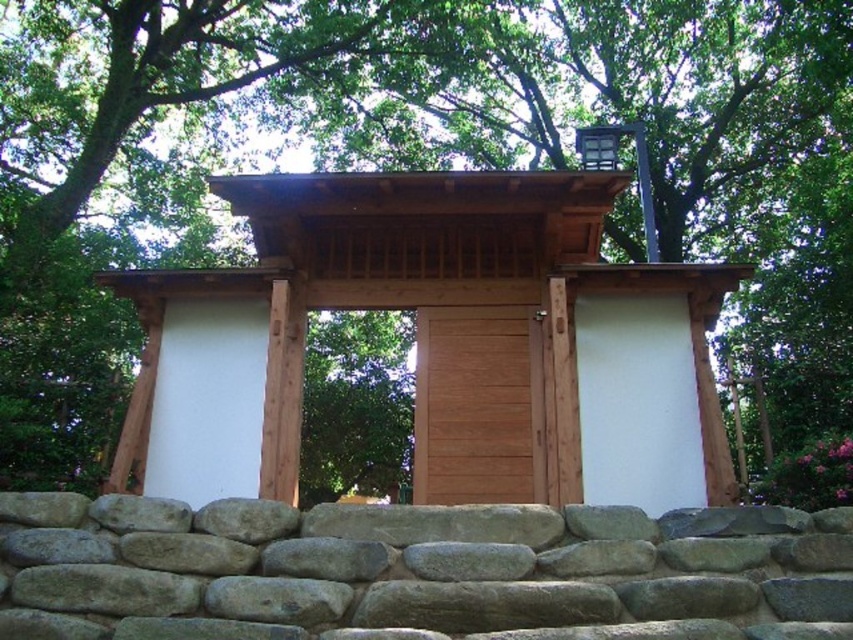
Does gray rough stone wall at lower center appear over wooden door at center?

No.

Find the location of a particular element. This screenshot has height=640, width=853. gray rough stone wall at lower center is located at coordinates (416, 572).

At what (x,y) coordinates should I click in order to perform the action: click on gray rough stone wall at lower center. Please return your answer as a coordinate pair (x, y). Looking at the image, I should click on (416, 572).

Does wooden gate at center have a larger size compared to wooden door at center?

No.

Does wooden gate at center have a smaller size compared to wooden door at center?

Yes.

Does point (152, 440) come farther from viewer compared to point (474, 321)?

That is False.

At what (x,y) coordinates should I click in order to perform the action: click on wooden gate at center. Please return your answer as a coordinate pair (x, y). The image size is (853, 640). Looking at the image, I should click on (442, 339).

Is wooden gate at center below gray rough stone wall at lower center?

Actually, wooden gate at center is above gray rough stone wall at lower center.

Is point (276, 419) in front of point (260, 518)?

No, it is not.

This screenshot has height=640, width=853. I want to click on wooden gate at center, so click(442, 339).